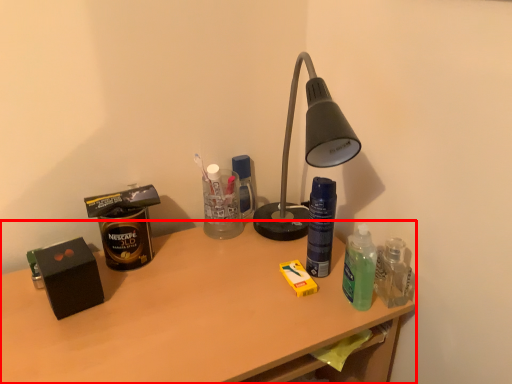
Question: Where is desk (annotated by the red box) located in relation to bottle in the image?

Choices:
 (A) left
 (B) right

Answer: (A)